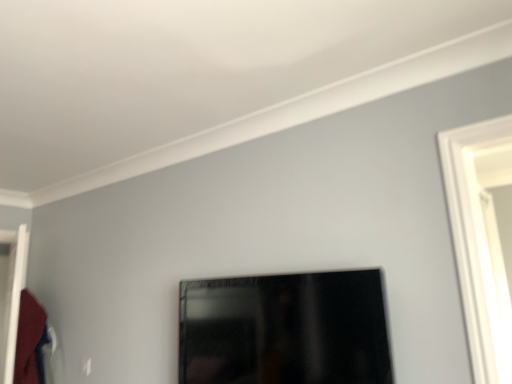
What is the approximate height of matte black picture frame at center?

It is 16.14 inches.

This screenshot has height=384, width=512. What are the coordinates of `velvet red robe at left` in the screenshot? It's located at (30, 341).

Image resolution: width=512 pixels, height=384 pixels. In order to click on white glossy door at left in this screenshot , I will do `click(12, 297)`.

Is velvet red robe at left to the right of white glossy door at left from the viewer's perspective?

Yes.

From a real-world perspective, between velvet red robe at left and white glossy door at left, who is vertically lower?

In real-world perspective, velvet red robe at left is lower.

From the image's perspective, between velvet red robe at left and white glossy door at left, which one is located above?

From the image's view, white glossy door at left is above.

From a real-world perspective, between matte black picture frame at center and white glossy door at left, who is vertically higher?

white glossy door at left.

Which object is wider, matte black picture frame at center or white glossy door at left?

white glossy door at left is wider.

Is point (10, 246) positioned in front of point (36, 339)?

That is True.

From the image's perspective, which is below, white glossy door at left or velvet red robe at left?

From the image's view, velvet red robe at left is below.

Locate an element on the screen. This screenshot has height=384, width=512. door that appears above the velvet red robe at left (from a real-world perspective) is located at coordinates (12, 297).

Are white glossy door at left and matte black picture frame at center far apart?

Yes, white glossy door at left is far from matte black picture frame at center.

Based on their sizes in the image, would you say white glossy door at left is bigger or smaller than matte black picture frame at center?

white glossy door at left is bigger than matte black picture frame at center.

Considering the points (17, 264) and (267, 277), which point is behind, point (17, 264) or point (267, 277)?

The point (17, 264) is more distant.

How far apart are velvet red robe at left and matte black picture frame at center?

velvet red robe at left and matte black picture frame at center are 1.51 meters apart from each other.

Is velvet red robe at left to the left of matte black picture frame at center from the viewer's perspective?

Correct, you'll find velvet red robe at left to the left of matte black picture frame at center.

From a real-world perspective, is velvet red robe at left on matte black picture frame at center?

No, from a real-world perspective, velvet red robe at left is not on top of matte black picture frame at center.

Is velvet red robe at left positioned with its back to matte black picture frame at center?

velvet red robe at left is not turned away from matte black picture frame at center.

From the image's perspective, does matte black picture frame at center appear higher than velvet red robe at left?

Yes, from the image's perspective, matte black picture frame at center is above velvet red robe at left.

From a real-world perspective, is matte black picture frame at center physically located above or below velvet red robe at left?

matte black picture frame at center is situated higher than velvet red robe at left in the real world.

Between matte black picture frame at center and velvet red robe at left, which one is positioned behind?

velvet red robe at left.

The image size is (512, 384). I want to click on robe behind the white glossy door at left, so click(30, 341).

Identify the location of picture frame that is on the right side of white glossy door at left. (284, 330).

Considering their positions, is matte black picture frame at center positioned closer to velvet red robe at left than white glossy door at left?

Among the two, white glossy door at left is located nearer to velvet red robe at left.

Based on the photo, considering their positions, is white glossy door at left positioned closer to matte black picture frame at center than velvet red robe at left?

velvet red robe at left lies closer to matte black picture frame at center than the other object.

From the image, which object appears to be farther from white glossy door at left, matte black picture frame at center or velvet red robe at left?

Based on the image, matte black picture frame at center appears to be further to white glossy door at left.

Which object lies further to the anchor point white glossy door at left, velvet red robe at left or matte black picture frame at center?

matte black picture frame at center is positioned further to the anchor white glossy door at left.

Considering their positions, is velvet red robe at left positioned further to matte black picture frame at center than white glossy door at left?

white glossy door at left is positioned further to the anchor matte black picture frame at center.

Which object lies further to the anchor point velvet red robe at left, white glossy door at left or matte black picture frame at center?

The object further to velvet red robe at left is matte black picture frame at center.

What are the coordinates of `robe between white glossy door at left and matte black picture frame at center` in the screenshot? It's located at (30, 341).